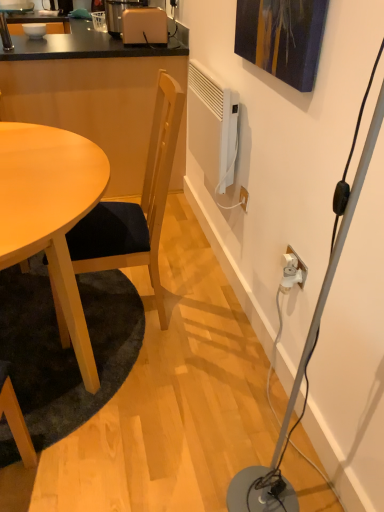
This screenshot has height=512, width=384. I want to click on vacant space to the right of light wood table at left, so click(x=210, y=348).